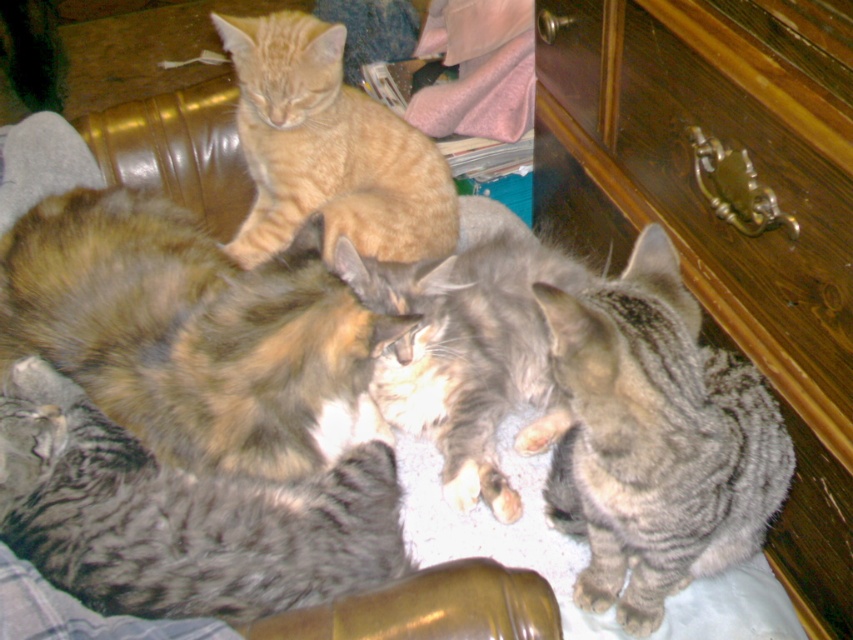
You are standing in the room and see two points marked in the image. The first point is at coordinate point (241,276) and the second point is at coordinate point (376,529). Which point is closer to you?

Point (376,529) is closer to you because point (241,276) is behind it.

You are a photographer trying to capture a photo of the calico fur cat at center and the gray striped cat at lower right. Based on their positions, which cat should you focus on first if you want to include both in the frame without moving the camera?

The calico fur cat at center is positioned on the left side of the gray striped cat at lower right, so you should focus on the calico fur cat at center first to ensure both are in the frame without moving the camera.